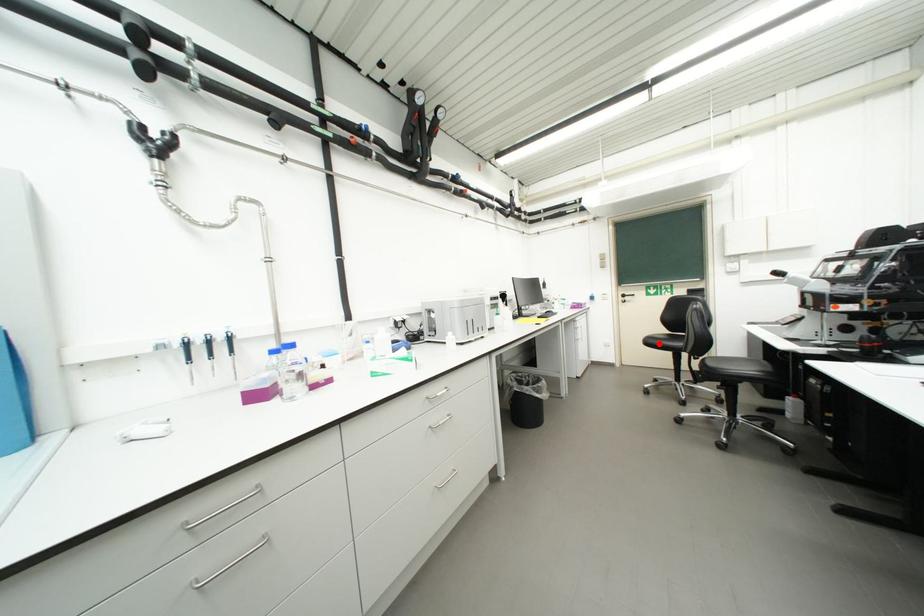
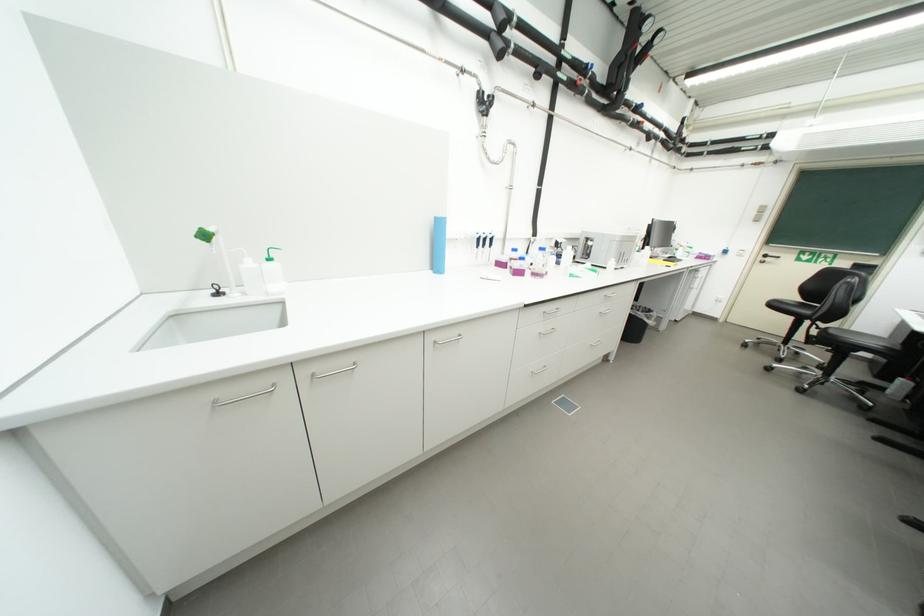
Question: A red point is marked in image1. In image2, is the corresponding 3D point closer to the camera or farther? Reply with the corresponding letter.

Choices:
 (A) The corresponding 3D point is closer.
 (B) The corresponding 3D point is farther.

Answer: (B)